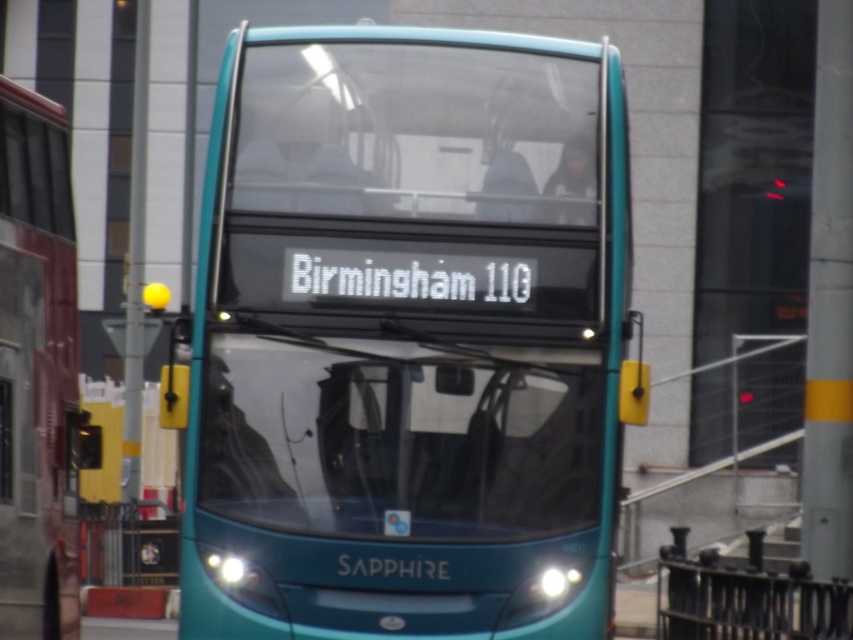
You are a city planner analyzing the width of buses for lane design. You observe two buses in the image, the teal glossy bus at center and the teal glossy bus at left. Based on the image, which bus requires a wider lane for safe passage?

The teal glossy bus at center requires a wider lane for safe passage because it is wider than the teal glossy bus at left according to the description.

You are a pedestrian standing in front of the teal glossy bus at left. You want to walk to the teal glossy bus at center. Which direction should you move in?

The teal glossy bus at center is to the right of the teal glossy bus at left, so you should move to the right to reach it.

You are a pedestrian standing in front of the teal glossy bus at center and the teal glossy bus at left. Which bus is closer to you?

The teal glossy bus at center is closer to you because it is positioned over the teal glossy bus at left, indicating it is in front.